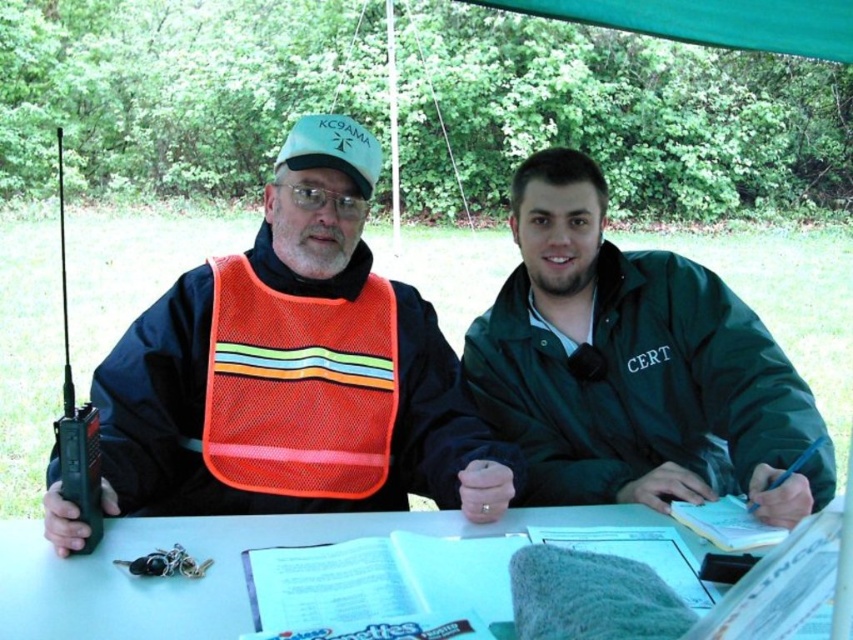
You are standing at the origin point in the image and want to locate the green matte jacket at center. Which direction should you move to reach it?

The green matte jacket at center is located at point 0.573 on the x axis and 0.743 on the y axis, so you should move right and forward to reach it.

You are a volunteer at an outdoor event and need to locate the orange mesh safety vest at center and the white paper at center. Based on the scene description, which object is positioned higher relative to the other?

The orange mesh safety vest at center is above the white paper at center, so it is positioned higher.

You are organizing a community event and need to place an emergency contact list on the table. The emergency contact list is the size of the white paper at center. Can the orange mesh safety vest at center also be placed on the table without overlapping?

The orange mesh safety vest at center is bigger than the white paper at center. Since the safety vest is larger, it might not fit on the table alongside the white paper without overlapping, depending on the table size. However, the description only provides size comparison between the two items, not the table dimensions. Without knowing the table size, it is impossible to determine if they can both fit without overlapping.